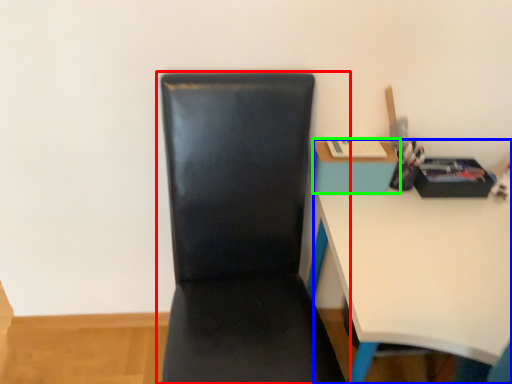
Question: Considering the real-world distances, which object is farthest from chair (highlighted by a red box)? desk (highlighted by a blue box) or table (highlighted by a green box)?

Choices:
 (A) desk
 (B) table

Answer: (B)